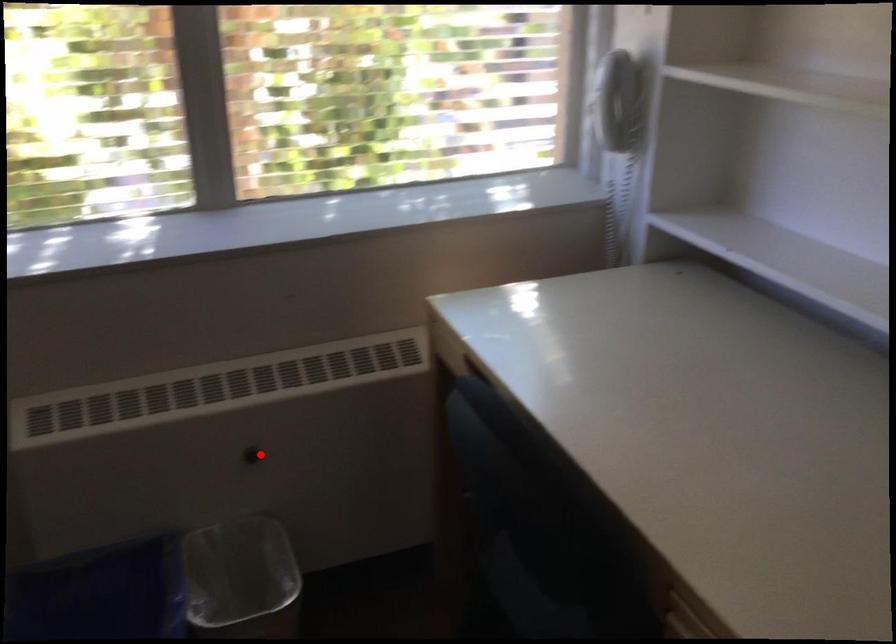
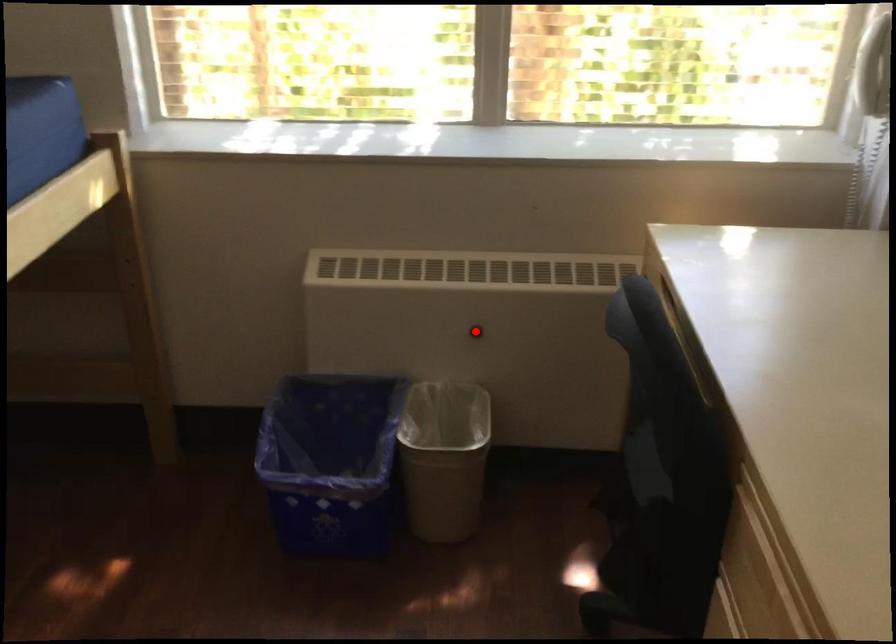
I am providing you with two images of the same scene from different viewpoints. A red point is marked on the first image and another point is marked on the second image. Does the point marked in image1 correspond to the same location as the one in image2?

Yes